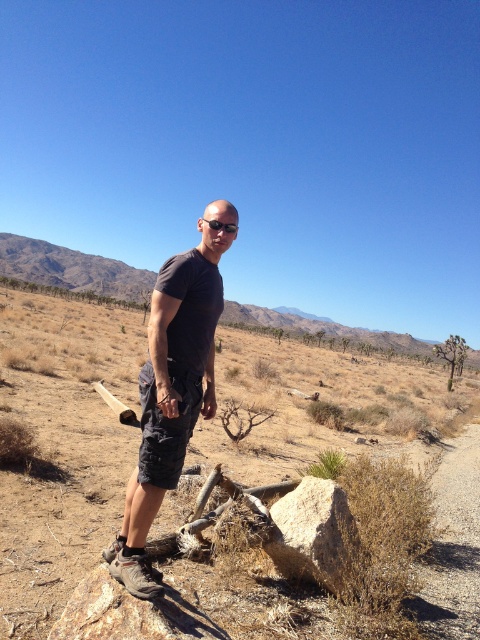
Question: Can you confirm if brown textured rock at center is thinner than dark gray t-shirt at center?

Choices:
 (A) yes
 (B) no

Answer: (B)

Question: Which of these objects is positioned closest to the smooth gray rock at center?

Choices:
 (A) dark gray t-shirt at center
 (B) brown textured rock at center

Answer: (A)

Question: Is brown textured rock at center bigger than smooth gray rock at center?

Choices:
 (A) yes
 (B) no

Answer: (A)

Question: Based on their relative distances, which object is farther from the brown textured rock at center?

Choices:
 (A) smooth gray rock at center
 (B) dark gray t-shirt at center
 (C) matte black goggles at center

Answer: (C)

Question: Is dark gray t-shirt at center below smooth gray rock at center?

Choices:
 (A) yes
 (B) no

Answer: (B)

Question: Which of the following is the closest to the observer?

Choices:
 (A) (210, 221)
 (B) (352, 536)
 (C) (168, 483)

Answer: (C)